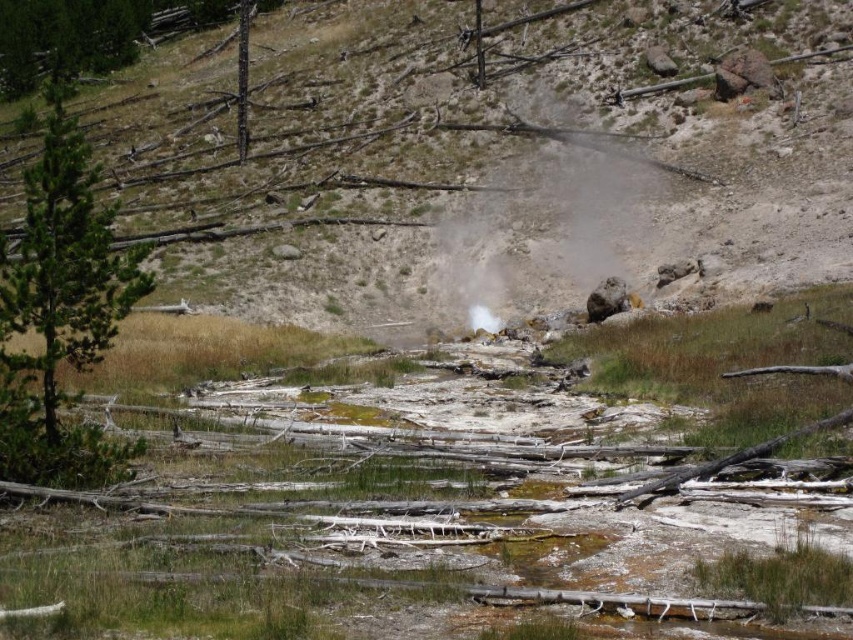
Does dull brown dirt at center have a greater width compared to white vapor at center?

Correct, the width of dull brown dirt at center exceeds that of white vapor at center.

This screenshot has height=640, width=853. What are the coordinates of `dull brown dirt at center` in the screenshot? It's located at (500, 168).

The image size is (853, 640). Identify the location of dull brown dirt at center. (500, 168).

Between dull brown dirt at center and green matte tree at left, which one appears on the right side from the viewer's perspective?

dull brown dirt at center

Does dull brown dirt at center have a greater height compared to green matte tree at left?

Correct, dull brown dirt at center is much taller as green matte tree at left.

Which is in front, point (589, 108) or point (50, 228)?

Positioned in front is point (50, 228).

What are the coordinates of `dull brown dirt at center` in the screenshot? It's located at (500, 168).

Which of these two, green matte tree at left or white vapor at center, stands shorter?

With less height is white vapor at center.

What do you see at coordinates (61, 308) in the screenshot? Image resolution: width=853 pixels, height=640 pixels. I see `green matte tree at left` at bounding box center [61, 308].

I want to click on green matte tree at left, so click(61, 308).